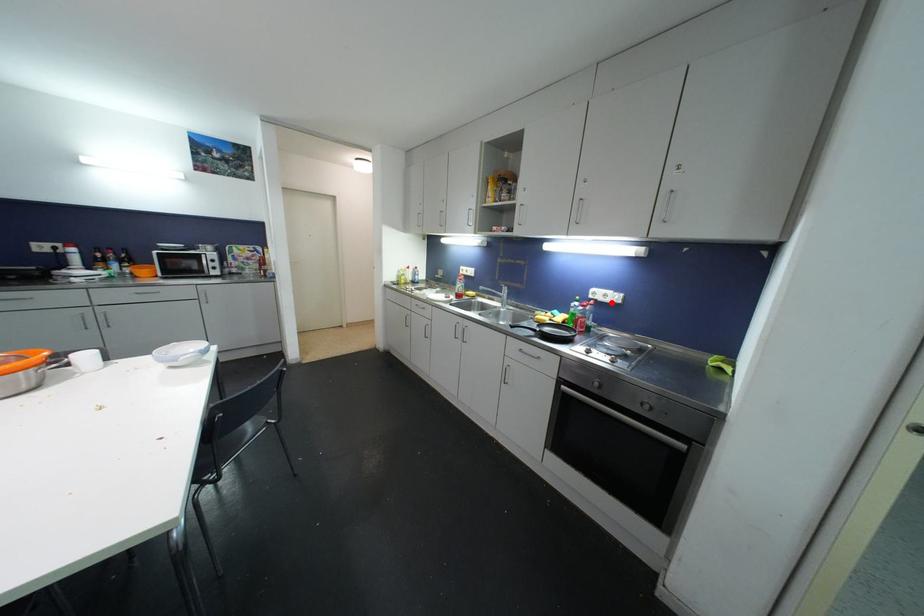
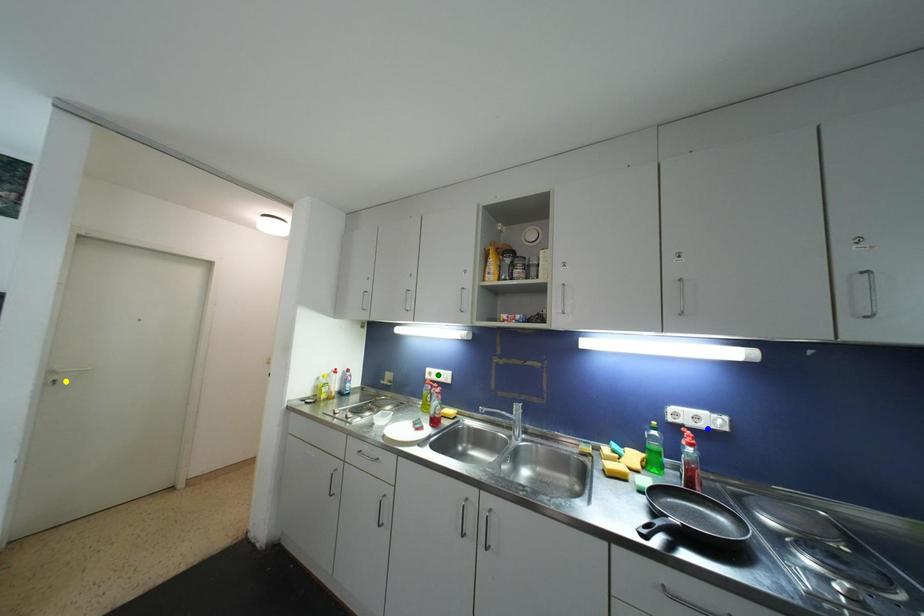
Question: I am providing you with two images of the same scene from different viewpoints. A red point is marked on the first image. You are given multiple points on the second image. Can you choose the point in image 2 that corresponds to the point in image 1?

Choices:
 (A) blue point
 (B) green point
 (C) yellow point

Answer: (A)